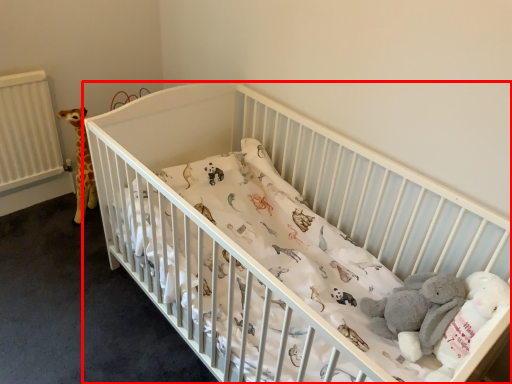
Question: Observing the image, what is the correct spatial positioning of infant bed (annotated by the red box) in reference to baby elephant?

Choices:
 (A) right
 (B) left

Answer: (B)